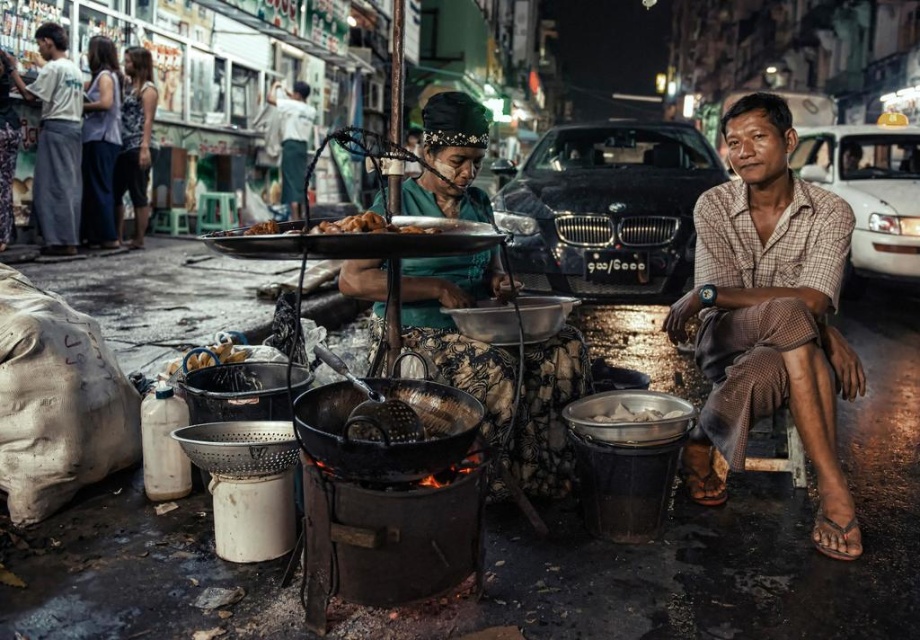
Based on the photo, you are a delivery person standing in the street scene. You need to deliver a package to the cooking woman. The package is 30 inches wide. Can you fit the package between the brown checkered shirt at right and green fabric skirt at center without bending it?

The distance between the brown checkered shirt at right and green fabric skirt at center is 29.91 inches. Since the package is 30 inches wide, it cannot fit through the space between them without bending.